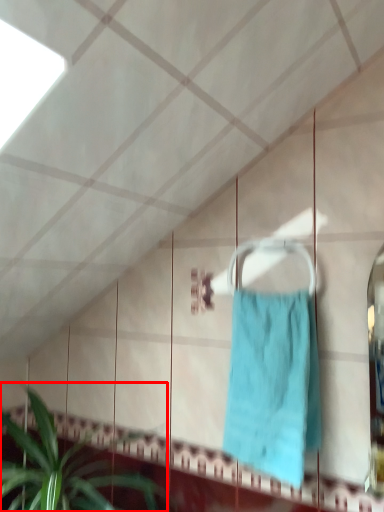
Question: From the image's perspective, what is the correct spatial positioning of houseplant (annotated by the red box) in reference to towel?

Choices:
 (A) below
 (B) above

Answer: (A)